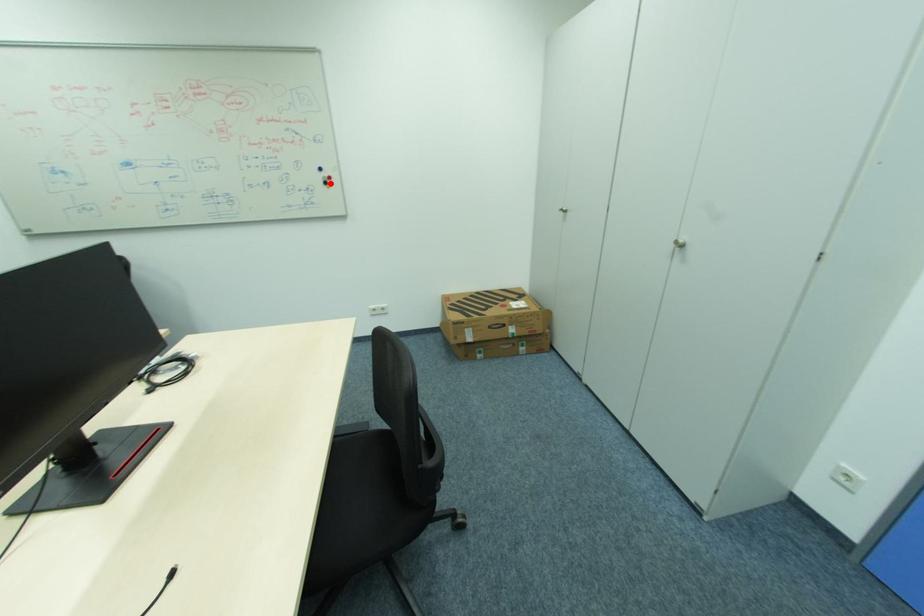
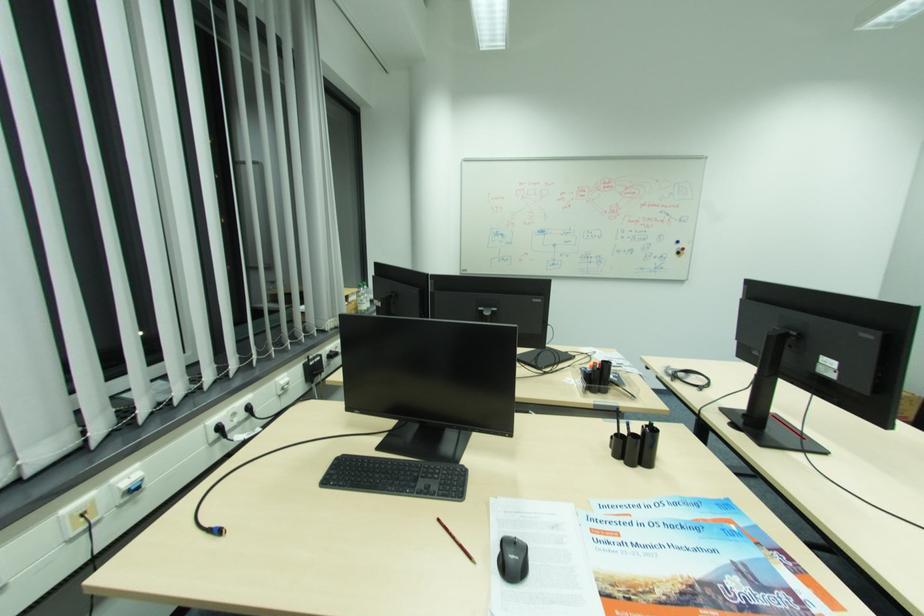
Where in the second image is the point corresponding to the highlighted location from the first image?

(684, 253)